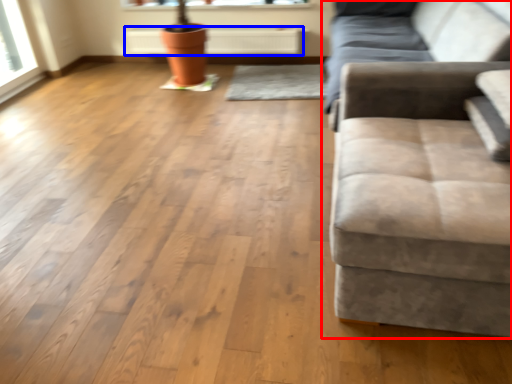
Question: Among these objects, which one is farthest to the camera, studio couch (highlighted by a red box) or radiator (highlighted by a blue box)?

Choices:
 (A) studio couch
 (B) radiator

Answer: (B)